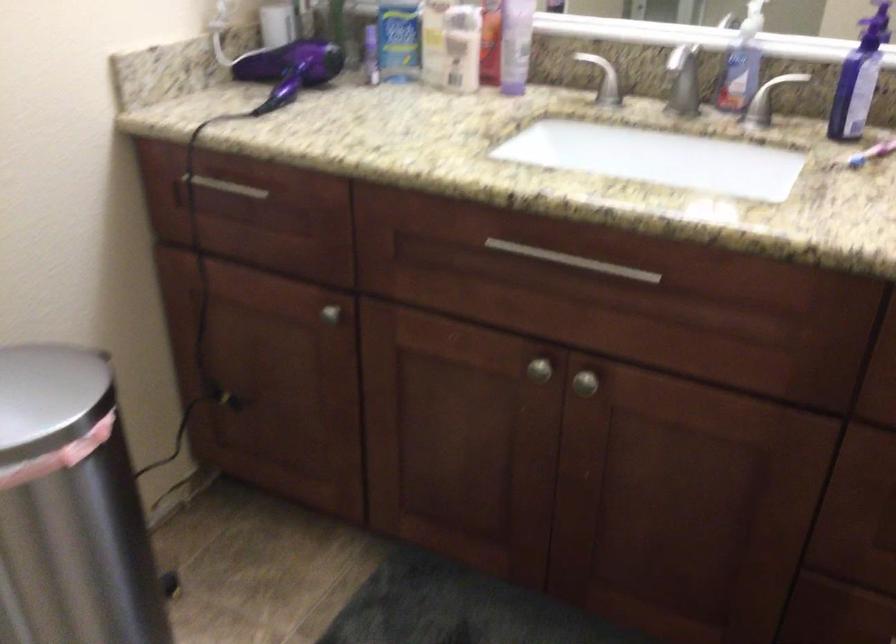
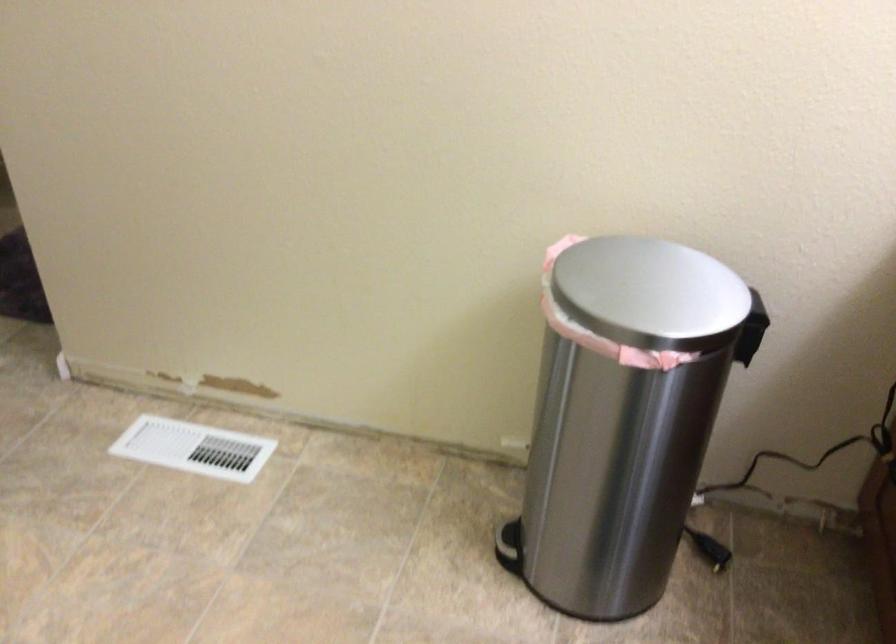
The first image is from the beginning of the video and the second image is from the end. How did the camera likely rotate when shooting the video?

The camera rotated toward left-down.